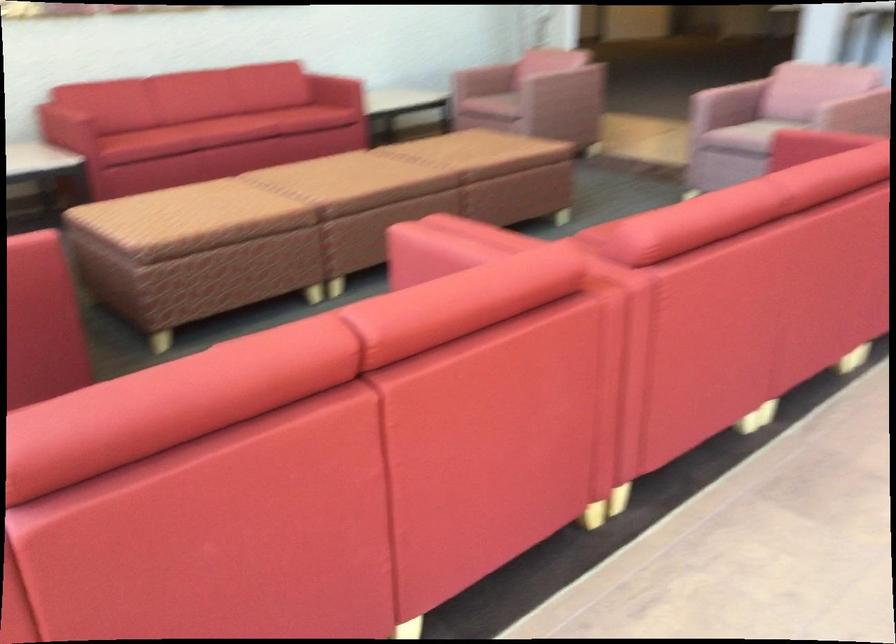
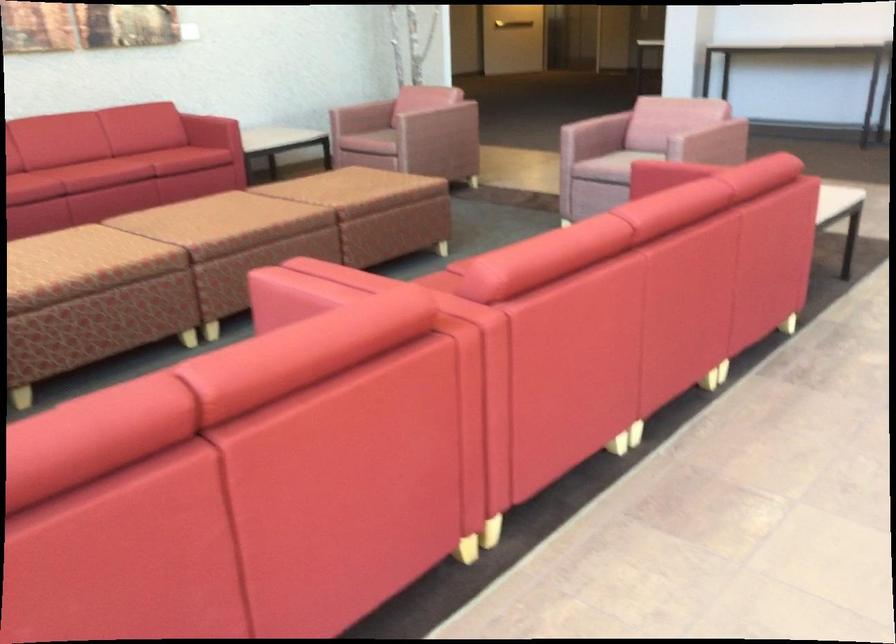
In the second image, find the point that corresponds to point (554, 71) in the first image.

(431, 106)